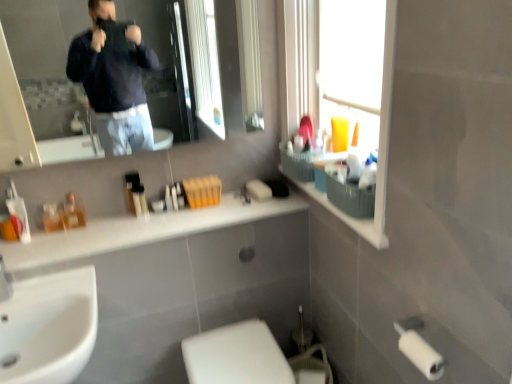
At what (x,y) coordinates should I click in order to perform the action: click on blank space situated above white glossy counter top at center (from a real-world perspective). Please return your answer as a coordinate pair (x, y). Image resolution: width=512 pixels, height=384 pixels. Looking at the image, I should click on (111, 231).